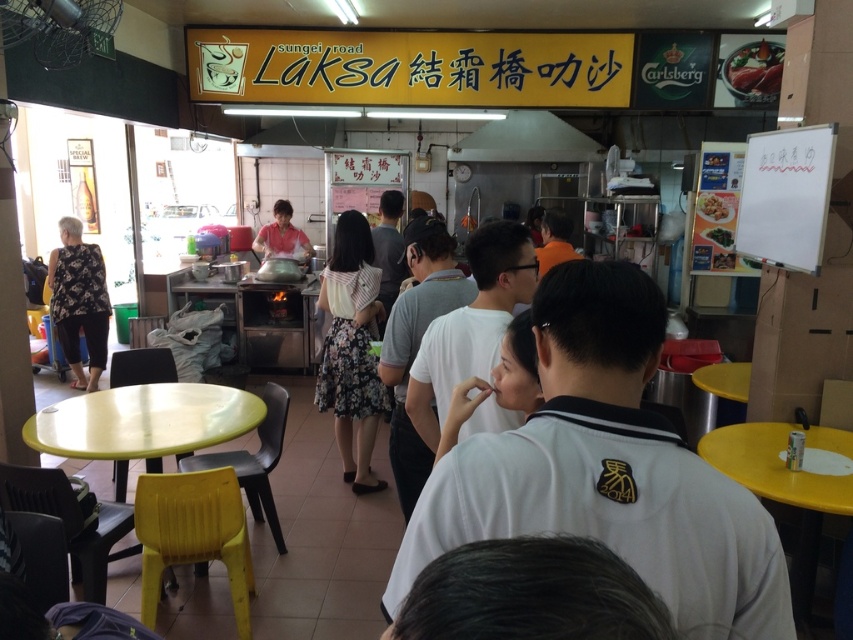
Consider the image. Is white matte shirt at center wider than white glossy bowl at center?

Correct, the width of white matte shirt at center exceeds that of white glossy bowl at center.

Which is behind, point (442, 257) or point (711, 205)?

Positioned behind is point (711, 205).

Consider the image. Measure the distance between point [413,340] and camera.

2.57 meters

Identify the location of white matte shirt at center. The width and height of the screenshot is (853, 640). (416, 342).

Who is lower down, floral-patterned dress at center or white glossy bowl at center?

floral-patterned dress at center is lower down.

Between floral-patterned dress at center and white glossy bowl at center, which one has more height?

Standing taller between the two is floral-patterned dress at center.

Which is behind, point (364, 244) or point (715, 216)?

Positioned behind is point (715, 216).

I want to click on floral-patterned dress at center, so (x=351, y=348).

Measure the distance between point [756,422] and camera.

The distance of point [756,422] from camera is 3.13 meters.

The image size is (853, 640). What are the coordinates of `yellow plastic table at lower right` in the screenshot? It's located at (779, 484).

Between point (756, 438) and point (86, 300), which one is positioned in front?

Positioned in front is point (756, 438).

The width and height of the screenshot is (853, 640). What are the coordinates of `yellow plastic table at lower right` in the screenshot? It's located at (779, 484).